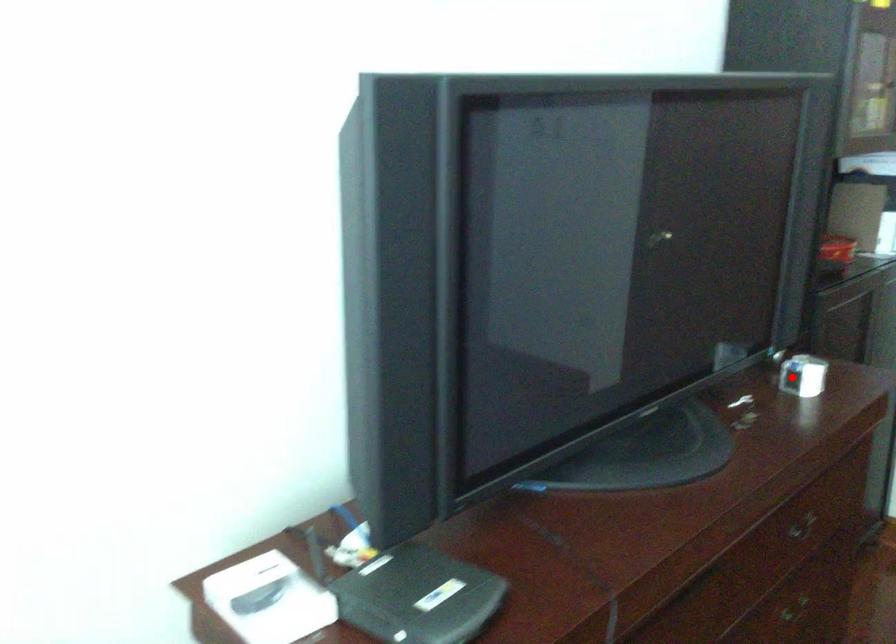
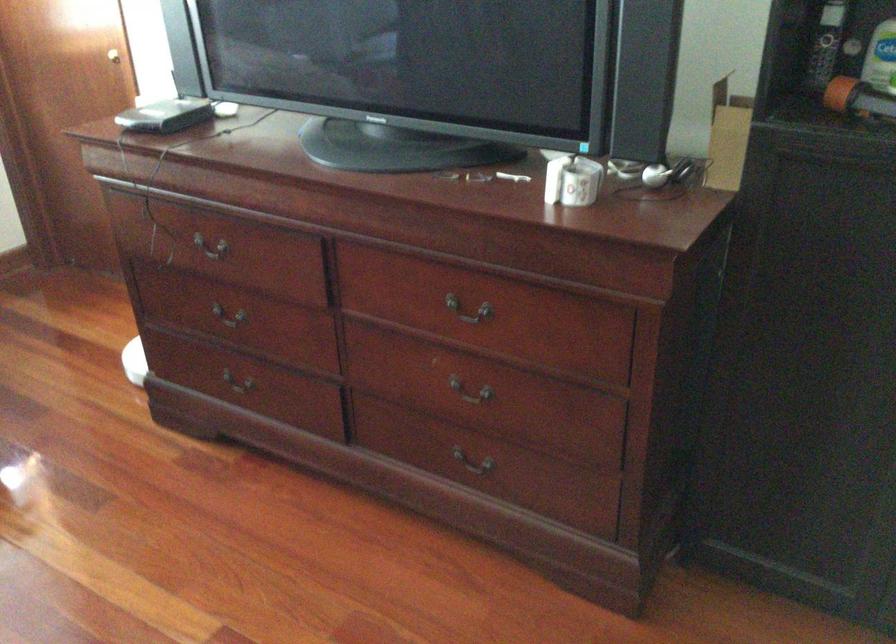
Find the pixel in the second image that matches the highlighted location in the first image.

(572, 180)